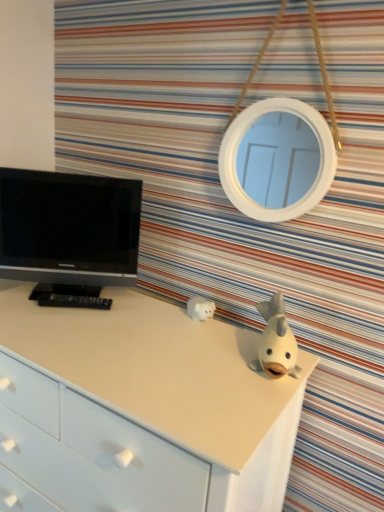
This screenshot has width=384, height=512. What are the coordinates of `vacant area that is in front of white matte piggy bank at center, the second toy from the right` in the screenshot? It's located at (204, 344).